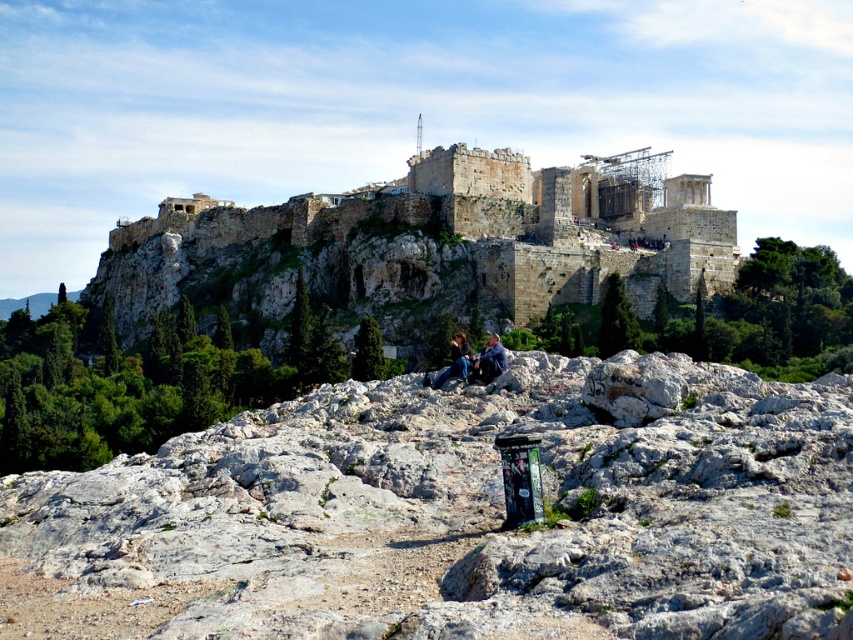
Question: Is blue denim jeans at center wider than blue jeans at center?

Choices:
 (A) yes
 (B) no

Answer: (A)

Question: Does white rock at center have a larger size compared to blue denim jeans at center?

Choices:
 (A) no
 (B) yes

Answer: (B)

Question: Which point is farther to the camera?

Choices:
 (A) (543, 474)
 (B) (486, 301)

Answer: (B)

Question: Which point appears closest to the camera in this image?

Choices:
 (A) (491, 374)
 (B) (247, 461)
 (C) (427, 253)
 (D) (456, 365)

Answer: (B)

Question: Which is farther from the blue jeans at center?

Choices:
 (A) white rock at center
 (B) blue denim jeans at center
 (C) stone/rough stone ancient structure at upper center

Answer: (C)

Question: Observing the image, what is the correct spatial positioning of blue denim jeans at center in reference to blue jeans at center?

Choices:
 (A) above
 (B) below

Answer: (A)